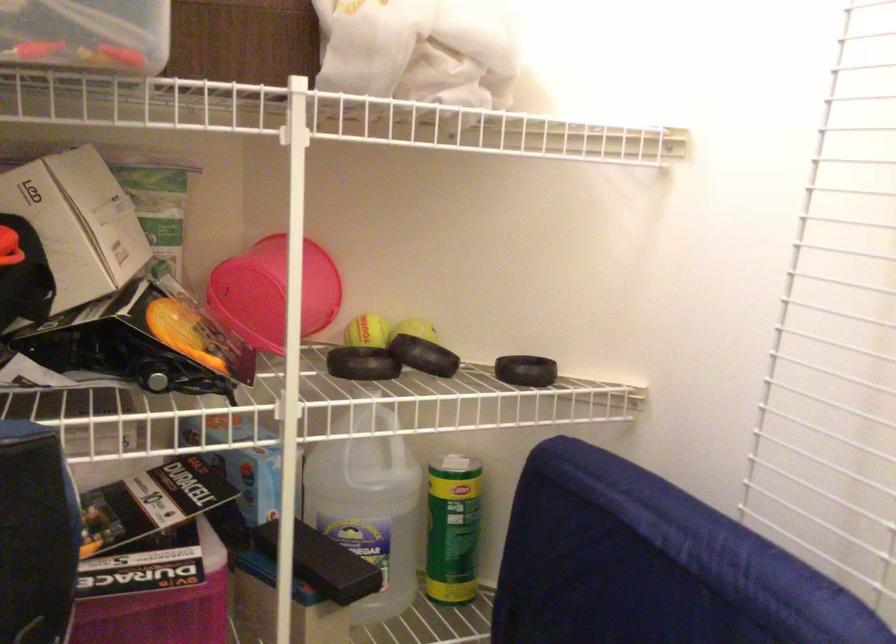
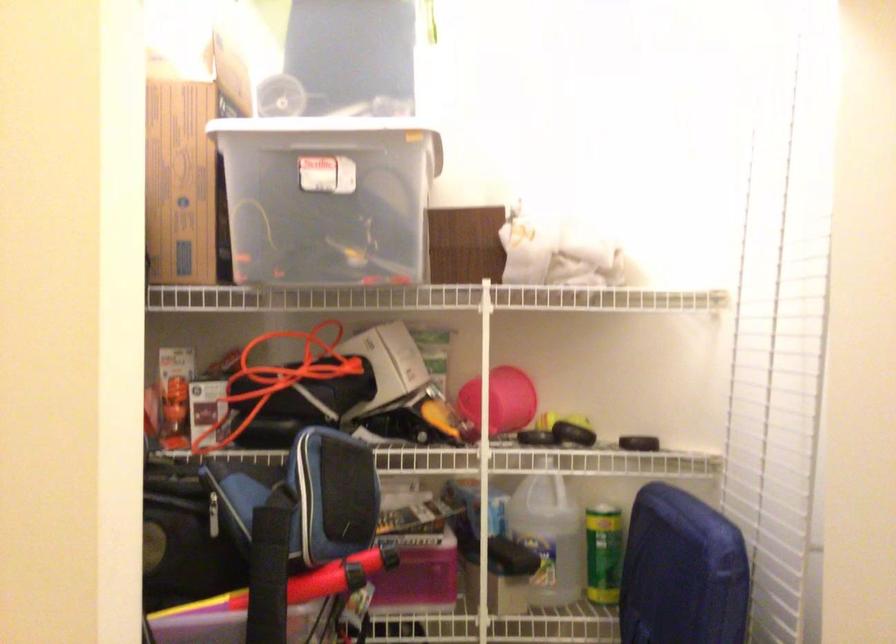
Where in the second image is the point corresponding to point (460, 533) from the first image?

(604, 554)